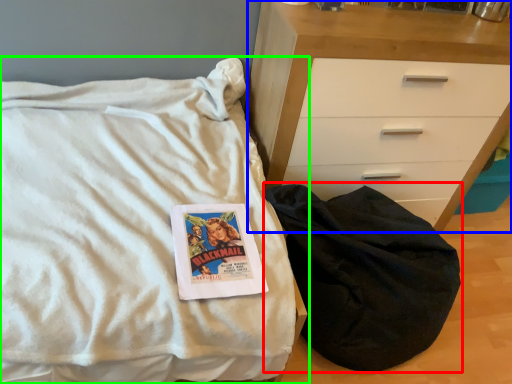
Question: Based on their relative distances, which object is nearer to sleeping bag (highlighted by a red box)? Choose from chest of drawers (highlighted by a blue box) and bed (highlighted by a green box).

Choices:
 (A) chest of drawers
 (B) bed

Answer: (A)